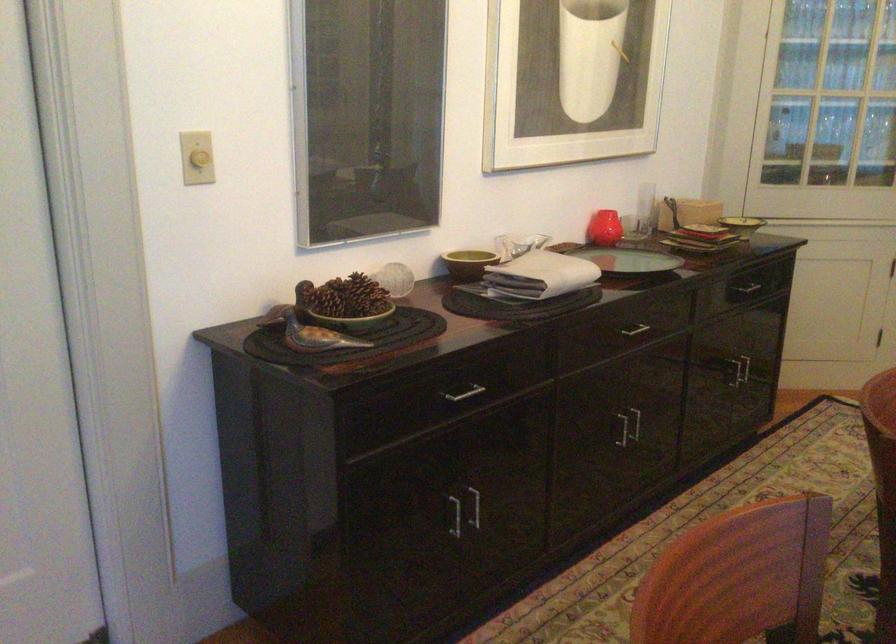
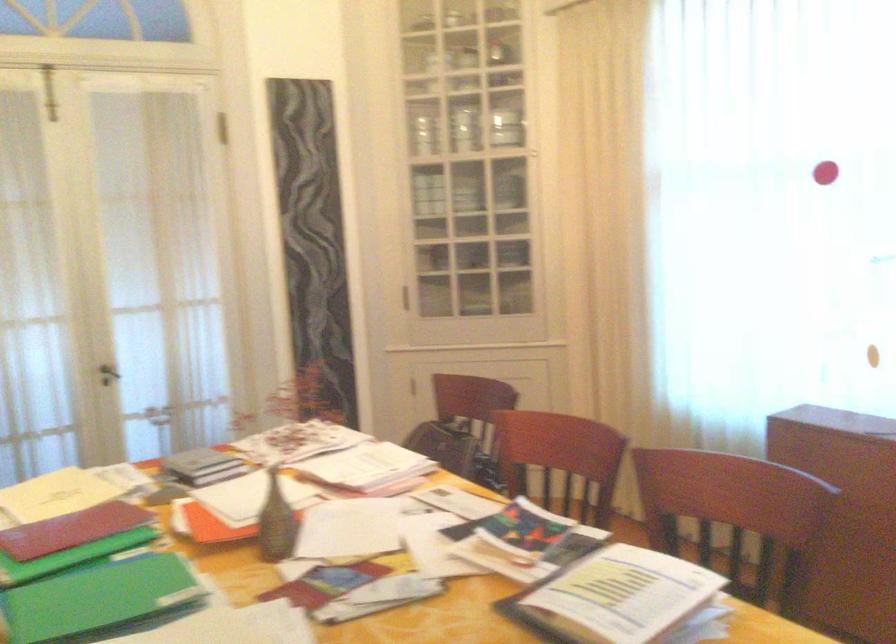
Question: Based on the continuous images, in which direction is the camera rotating? Reply with the corresponding letter.

Choices:
 (A) Left
 (B) Right
 (C) Up
 (D) Down

Answer: (B)